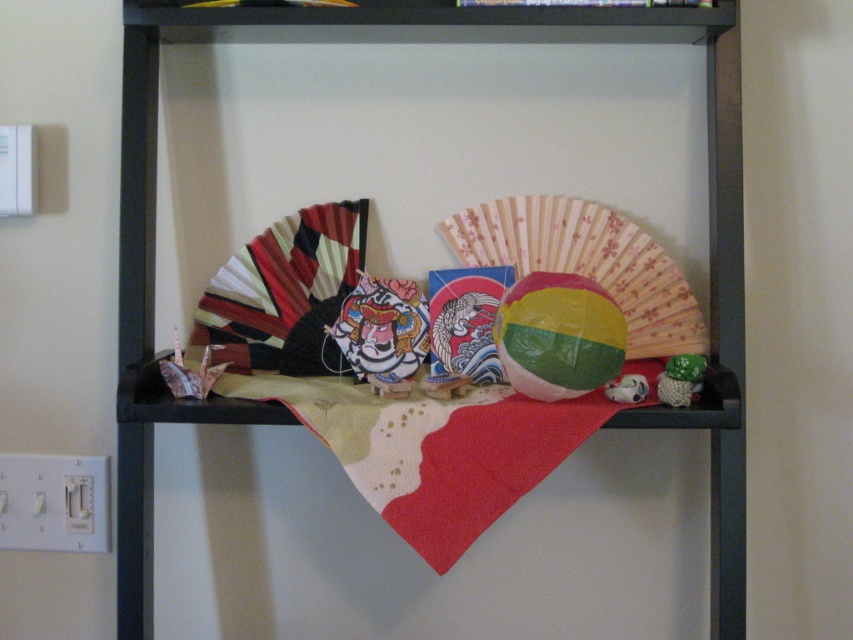
Question: Does origami crane at center have a greater width compared to green knitted toy at right?

Choices:
 (A) yes
 (B) no

Answer: (A)

Question: Which point is farther to the camera?

Choices:
 (A) origami crane at center
 (B) wooden shelf at center

Answer: (A)

Question: Which point is farther from the camera taking this photo?

Choices:
 (A) (170, 384)
 (B) (670, 397)

Answer: (A)

Question: Is matte paper fan at center thinner than green knitted toy at right?

Choices:
 (A) no
 (B) yes

Answer: (A)

Question: Estimate the real-world distances between objects in this image. Which object is closer to the green knitted toy at right?

Choices:
 (A) wooden shelf at center
 (B) matte paper fan at center
 (C) glossy paper mask at center

Answer: (B)

Question: Can you confirm if wooden shelf at center is positioned below green knitted toy at right?

Choices:
 (A) no
 (B) yes

Answer: (A)